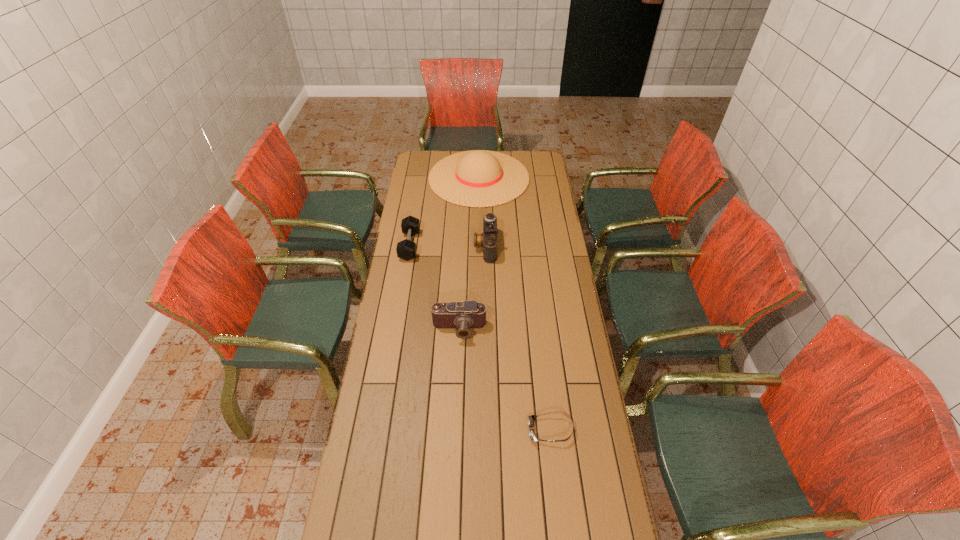
This screenshot has height=540, width=960. Find the location of `bonnet that is at the right edge`. bonnet that is at the right edge is located at coordinates (477, 178).

Identify the location of goggles that is at the right edge. Image resolution: width=960 pixels, height=540 pixels. (531, 419).

You are a GUI agent. You are given a task and a screenshot of the screen. Output one action in this format:
    pyautogui.click(x=<x>, y=<y>)
    Task: Click on the object present at the far left corner
    This screenshot has width=960, height=540.
    Given the screenshot: What is the action you would take?
    tap(477, 178)

At what (x,y) coordinates should I click in order to perform the action: click on object situated at the far right corner. Please return your answer as a coordinate pair (x, y). Looking at the image, I should click on pos(477,178).

This screenshot has height=540, width=960. Find the location of `vacant region at the left edge`. vacant region at the left edge is located at coordinates (393, 300).

Where is `vacant area at the right edge`? vacant area at the right edge is located at coordinates [x=546, y=226].

Locate an element on the screen. Image resolution: width=960 pixels, height=540 pixels. free space at the far left corner of the desktop is located at coordinates (423, 165).

The height and width of the screenshot is (540, 960). I want to click on free spot at the far right corner of the desktop, so click(x=537, y=168).

Find the location of a particular element. vacant region between the leftmost object and the second nearest object is located at coordinates (435, 287).

Where is `unoccupied position between the nearer camera and the farther camera`? unoccupied position between the nearer camera and the farther camera is located at coordinates (472, 288).